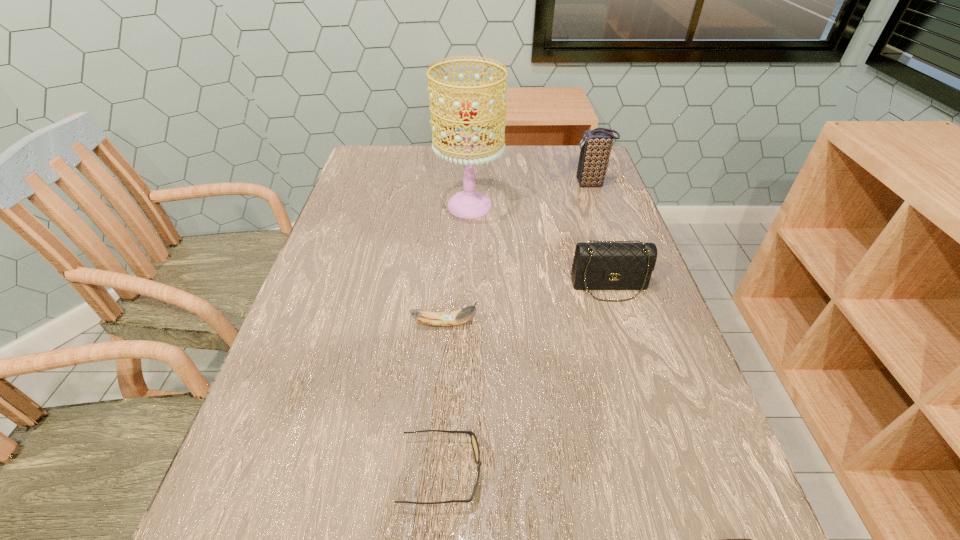
This screenshot has height=540, width=960. I want to click on lampshade, so click(x=469, y=204).

At what (x,y) coordinates should I click in order to perform the action: click on the fifth shortest object. Please return your answer as a coordinate pair (x, y). Looking at the image, I should click on (596, 146).

You are a GUI agent. You are given a task and a screenshot of the screen. Output one action in this format:
    pyautogui.click(x=<x>, y=<y>)
    Task: Click on the taller clutch bag
    The image size is (960, 540).
    Given the screenshot: What is the action you would take?
    pyautogui.click(x=596, y=146)

At what (x,y) coordinates should I click in order to perform the action: click on the third farthest object. Please return your answer as a coordinate pair (x, y). The image size is (960, 540). Looking at the image, I should click on click(x=600, y=265).

Locate an element on the screen. The image size is (960, 540). the third tallest object is located at coordinates (600, 265).

The height and width of the screenshot is (540, 960). In order to click on banana in this screenshot , I will do (463, 315).

Find the location of a particular element. This screenshot has height=540, width=960. the fourth farthest object is located at coordinates (463, 315).

The width and height of the screenshot is (960, 540). Identify the location of the fifth farthest object. (474, 442).

Locate an element on the screen. sunglasses is located at coordinates (474, 442).

Find the location of `free space located 0.300m on the front of the lampshade`. free space located 0.300m on the front of the lampshade is located at coordinates (467, 310).